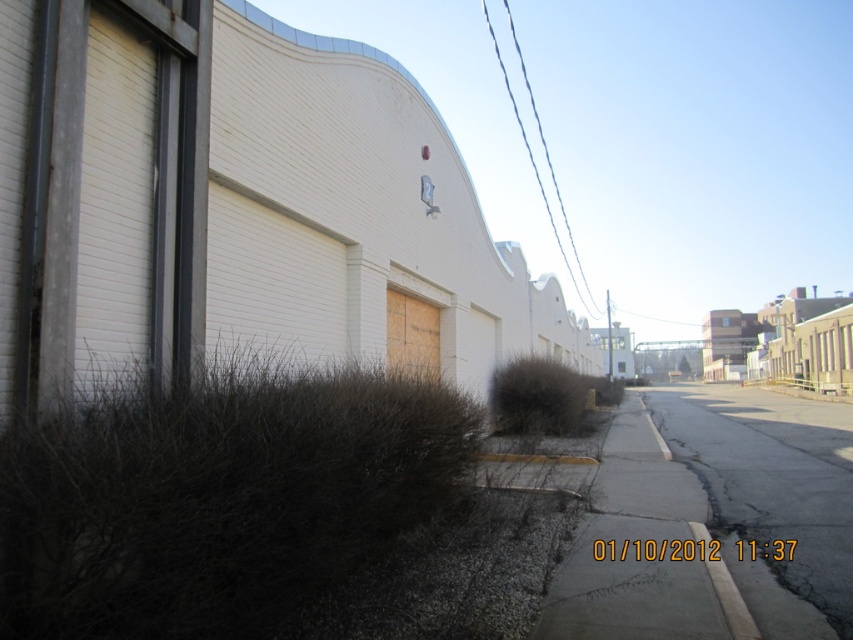
You are standing at the point marked by the coordinates point (x=769, y=486). Which object is directly beneath your feet?

The black asphalt road at center is directly beneath your feet at point (x=769, y=486).

You are a delivery driver planning to park your truck on the gray asphalt pavement at center. However, your truck requires a wider space than the pavement can provide. Based on the scene, can you use the black asphalt road at center instead?

The black asphalt road at center might be wider than gray asphalt pavement at center, so it could provide enough space for your truck. Consider using the black asphalt road at center for parking.